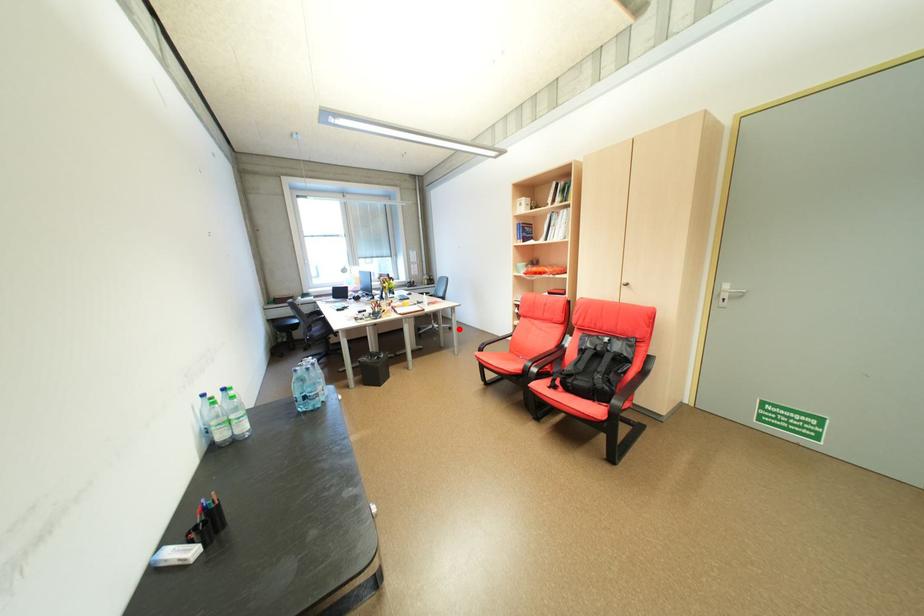
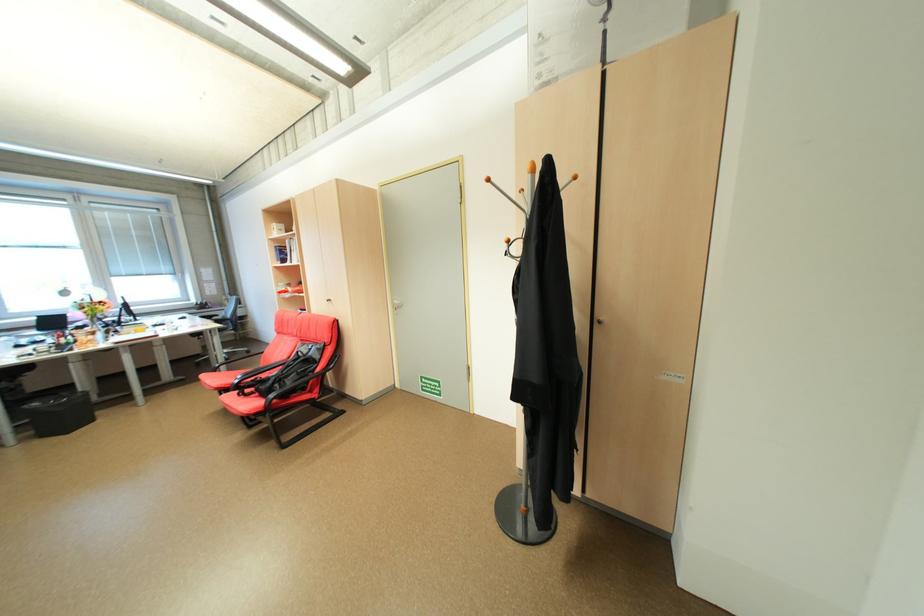
Where in the second image is the point corresponding to the highlighted location from the first image?

(257, 353)